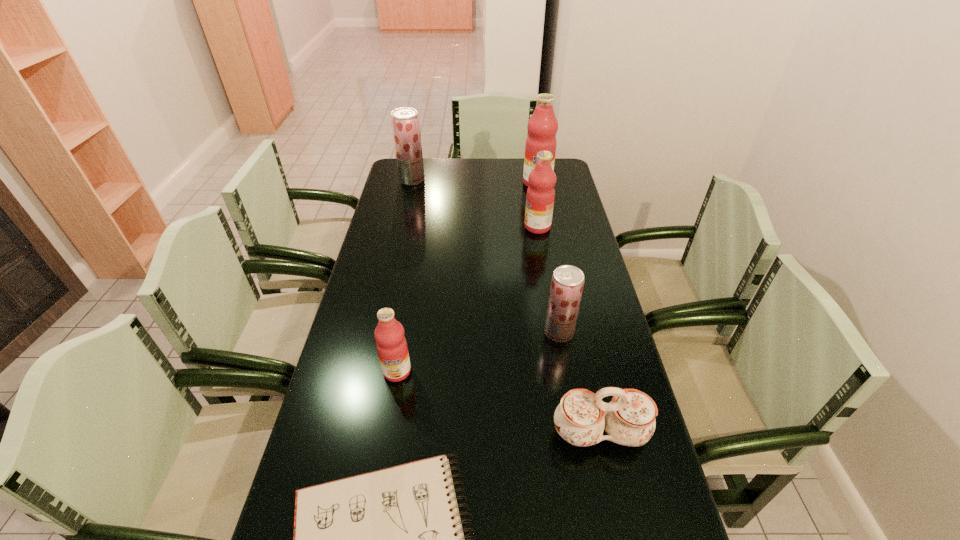
In order to click on the sixth tallest object in this screenshot , I will do `click(581, 417)`.

Image resolution: width=960 pixels, height=540 pixels. Identify the location of chinaware. (581, 417).

Identify the location of free location located on the label of the tallest fruit juice. (545, 227).

The height and width of the screenshot is (540, 960). What are the coordinates of `free region located on the right of the farther strawberry fruit juice` in the screenshot? It's located at (479, 180).

This screenshot has width=960, height=540. What are the coordinates of `vacant area situated on the label of the second smallest pink fruit juice` in the screenshot? It's located at (447, 227).

Where is `vacant space located on the label of the second smallest pink fruit juice`? vacant space located on the label of the second smallest pink fruit juice is located at coordinates (492, 227).

Find the location of a particular element. The height and width of the screenshot is (540, 960). vacant space located on the label of the second smallest pink fruit juice is located at coordinates (445, 227).

Locate an element on the screen. The image size is (960, 540). free spot located 0.220m on the front of the smaller strawberry fruit juice is located at coordinates (573, 413).

Identify the location of vacant space located on the label of the smallest pink fruit juice. This screenshot has width=960, height=540. (388, 425).

You are a GUI agent. You are given a task and a screenshot of the screen. Output one action in this format:
    pyautogui.click(x=<x>, y=<y>)
    Task: Click on the vacant space located by the handle of the chinaware
    
    Given the screenshot: What is the action you would take?
    pyautogui.click(x=621, y=533)